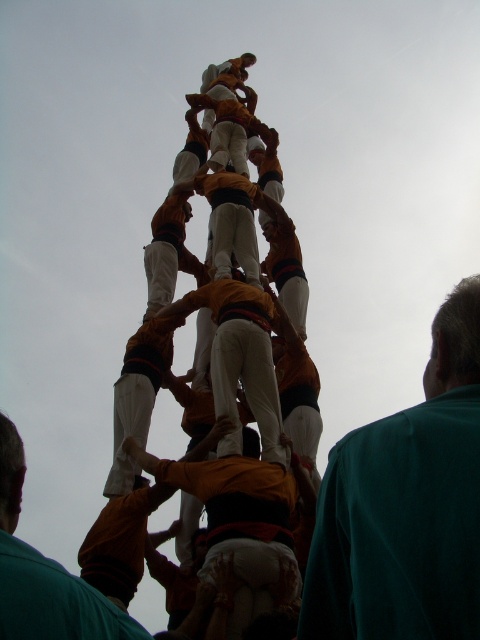
Is green fabric shirt at lower right shorter than orange fabric at center?

No, green fabric shirt at lower right is not shorter than orange fabric at center.

Does point (359, 467) come closer to viewer compared to point (47, 625)?

No, (359, 467) is behind (47, 625).

You are a GUI agent. You are given a task and a screenshot of the screen. Output one action in this format:
    pyautogui.click(x=<x>, y=<y>)
    Task: Click on the green fabric shirt at lower right
    Image resolution: width=480 pixels, height=640 pixels.
    Given the screenshot: What is the action you would take?
    pyautogui.click(x=406, y=506)

Is orange fabric man at center thinner than orange fabric at center?

In fact, orange fabric man at center might be wider than orange fabric at center.

Is point (232, 614) farther from viewer compared to point (45, 627)?

Yes, it is.

Is point (288, 488) positioned behind point (3, 579)?

Yes, point (288, 488) is farther from viewer.

Locate an element on the screen. The width and height of the screenshot is (480, 640). orange fabric man at center is located at coordinates (236, 518).

Between green fabric shirt at lower right and orange fabric man at center, which one appears on the left side from the viewer's perspective?

orange fabric man at center is more to the left.

Which is behind, point (452, 616) or point (132, 456)?

The point (132, 456) is behind.

Where is `green fabric shirt at lower right`? green fabric shirt at lower right is located at coordinates (406, 506).